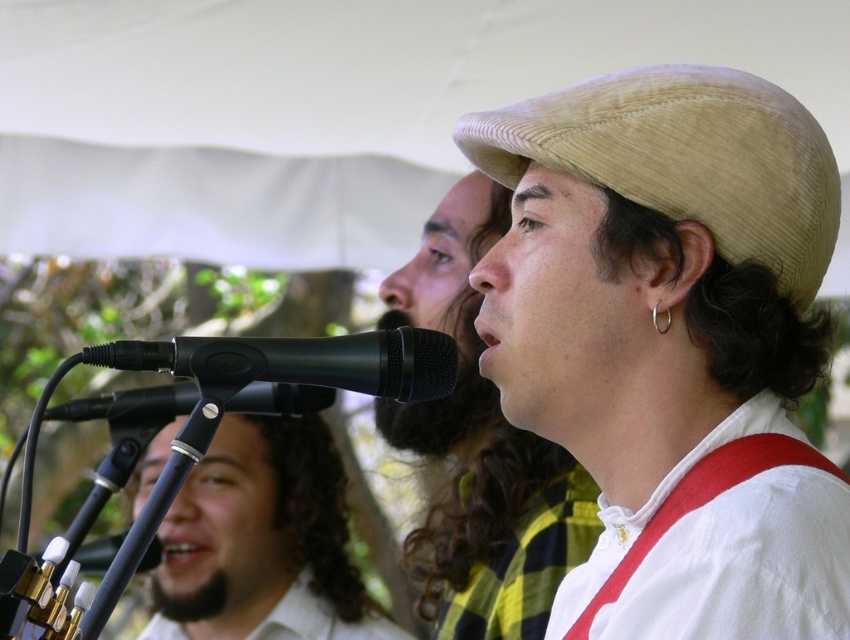
Question: Among these points, which one is nearest to the camera?

Choices:
 (A) (255, 611)
 (B) (480, 244)

Answer: (B)

Question: In this image, where is black matte microphone at center located relative to red fabric suspenders at center?

Choices:
 (A) above
 (B) below

Answer: (A)

Question: Can you confirm if white matte shirt at lower left is positioned above black matte microphone at center?

Choices:
 (A) yes
 (B) no

Answer: (B)

Question: Which point is farther from the camera taking this photo?

Choices:
 (A) (721, 468)
 (B) (245, 460)

Answer: (B)

Question: Is white matte shirt at lower left smaller than black matte microphone at center?

Choices:
 (A) yes
 (B) no

Answer: (B)

Question: Which is farther from the beige corduroy cowboy hat at upper right?

Choices:
 (A) black matte microphone at center
 (B) red fabric suspenders at center
 (C) white matte shirt at lower left

Answer: (C)